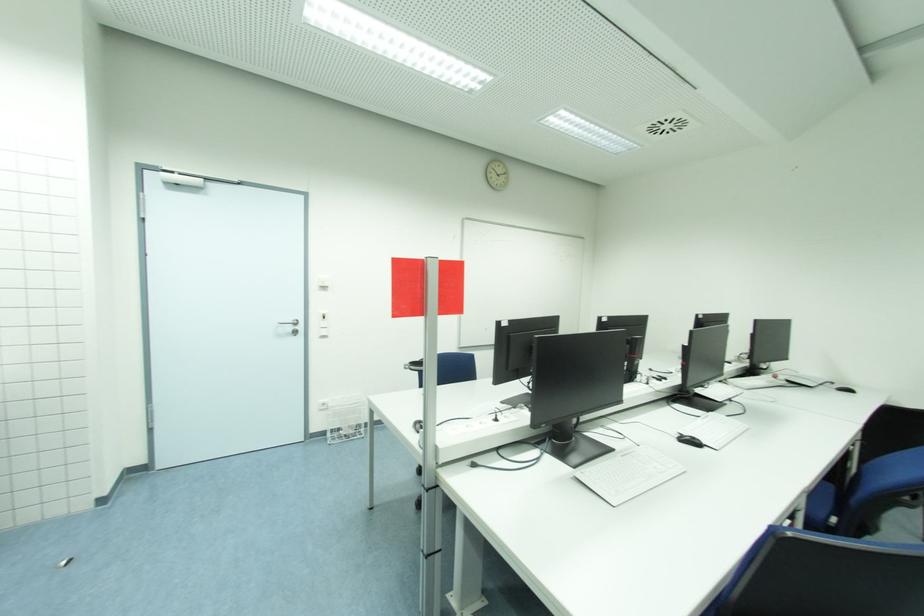
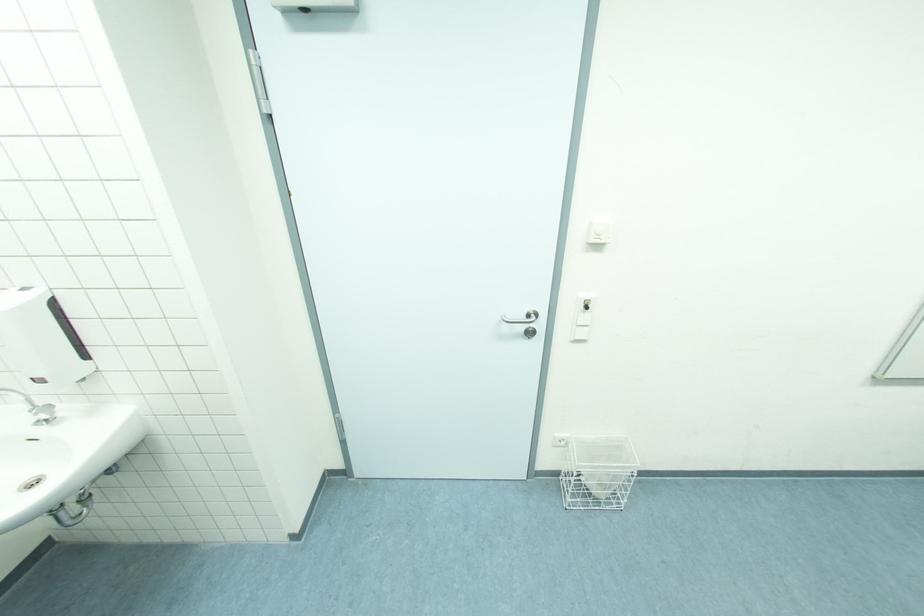
The point at (329, 432) is marked in the first image. Where is the corresponding point in the second image?

(563, 472)